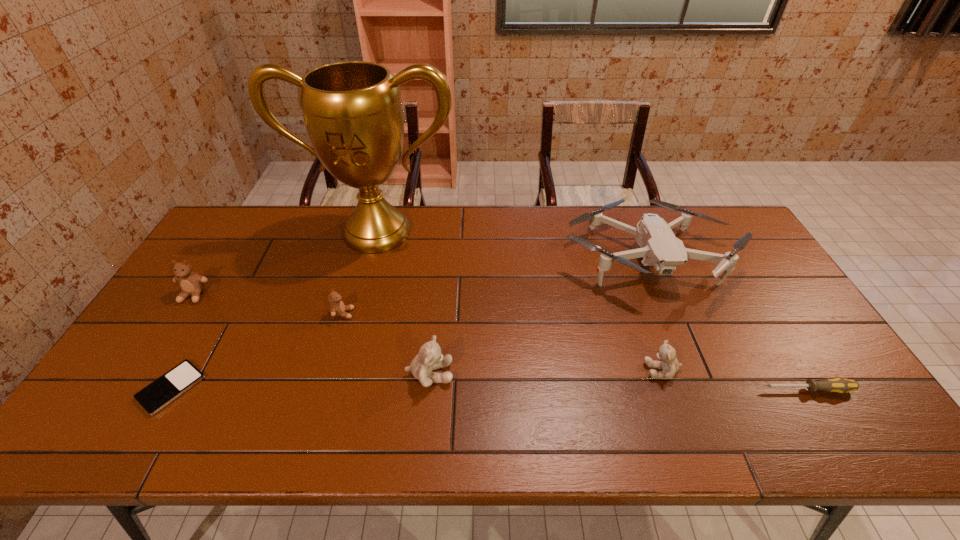
Image resolution: width=960 pixels, height=540 pixels. I want to click on vacant space located 0.210m on the face of the rightmost teddy bear, so click(562, 370).

Where is `vacant area situated on the face of the rightmost teddy bear`? This screenshot has height=540, width=960. vacant area situated on the face of the rightmost teddy bear is located at coordinates (538, 370).

Where is `free space located on the face of the rightmost teddy bear`? free space located on the face of the rightmost teddy bear is located at coordinates (578, 370).

This screenshot has width=960, height=540. Find the location of `free space located at the tip of the gray screwdriver`. free space located at the tip of the gray screwdriver is located at coordinates tap(606, 390).

Locate an element on the screen. This screenshot has height=540, width=960. vacant region located 0.220m at the tip of the gray screwdriver is located at coordinates (671, 390).

Find the location of a particular element. This screenshot has height=540, width=960. vacant space located at the tip of the gray screwdriver is located at coordinates pos(667,390).

This screenshot has height=540, width=960. I want to click on vacant space located 0.210m on the right of the shortest object, so click(x=287, y=388).

Identify the location of trophy cup at the far edge. (352, 110).

What are the coordinates of `drone positioned at the far edge` in the screenshot? It's located at point(660,248).

Locate an element on the screen. object that is at the near edge is located at coordinates (164, 390).